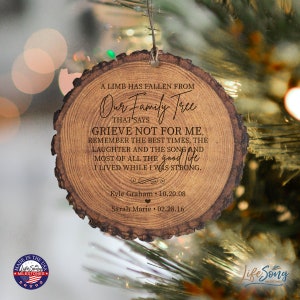
Where is `lights`? This screenshot has width=300, height=300. lights is located at coordinates (295, 106).